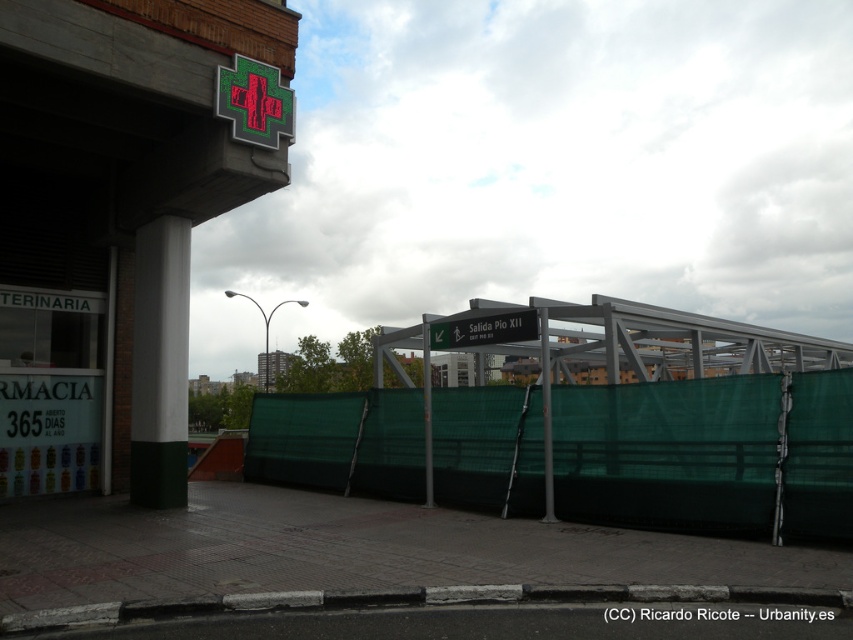
Between point (263, 84) and point (424, 342), which one is positioned behind?

Point (424, 342)

Does green matte cross at upper center appear under green metallic signpost at center?

No.

Where is `green matte cross at upper center`? green matte cross at upper center is located at coordinates (254, 102).

Find the location of a particular element. The width and height of the screenshot is (853, 640). green matte cross at upper center is located at coordinates (254, 102).

Which is above, green metallic sign at center or metallic gray pole at center?

green metallic sign at center is higher up.

Does green metallic sign at center have a greater height compared to metallic gray pole at center?

Indeed, green metallic sign at center has a greater height compared to metallic gray pole at center.

Is point (526, 307) less distant than point (540, 356)?

Yes, point (526, 307) is in front of point (540, 356).

Where is `green metallic sign at center`? Image resolution: width=853 pixels, height=640 pixels. green metallic sign at center is located at coordinates (485, 330).

Consider the image. Is green metallic sign at center to the right of green metallic signpost at center from the viewer's perspective?

Indeed, green metallic sign at center is positioned on the right side of green metallic signpost at center.

Who is more distant from viewer, (447, 346) or (425, 461)?

The point (425, 461) is more distant.

Where is `green metallic sign at center`? green metallic sign at center is located at coordinates (485, 330).

The image size is (853, 640). I want to click on green metallic sign at center, so click(x=485, y=330).